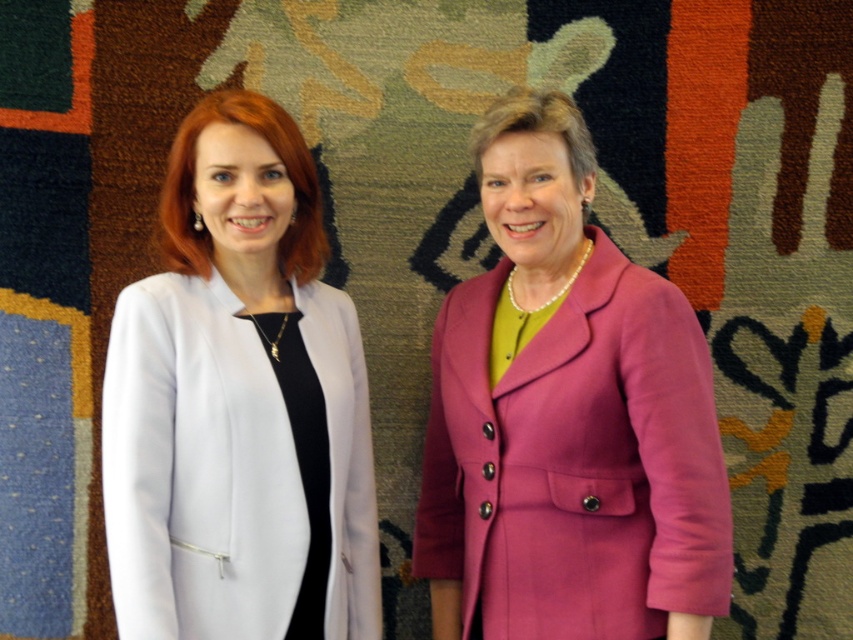
Consider the image. Is purple woolen coat at center thinner than white smooth coat at left?

No, purple woolen coat at center is not thinner than white smooth coat at left.

Does purple woolen coat at center have a greater width compared to white smooth coat at left?

Yes, purple woolen coat at center is wider than white smooth coat at left.

This screenshot has width=853, height=640. Find the location of `purple woolen coat at center`. purple woolen coat at center is located at coordinates (575, 461).